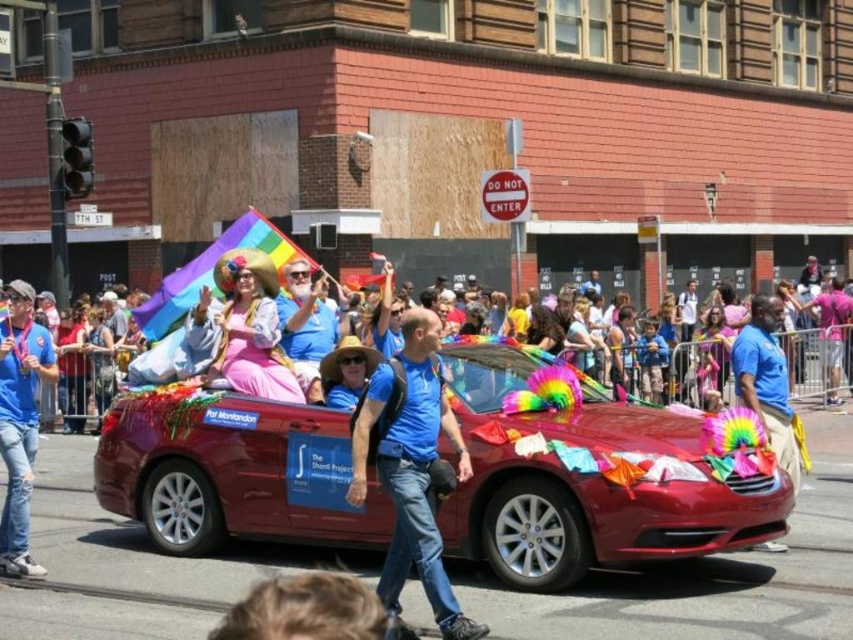
Question: Which is nearer to the shiny red convertible at center?

Choices:
 (A) blue cotton shirt at center
 (B) blue t-shirt at center
 (C) pastel fabric dress at center
 (D) matte blue shirt at center

Answer: (A)

Question: Is blue denim jeans at left to the left of blue t-shirt at center from the viewer's perspective?

Choices:
 (A) no
 (B) yes

Answer: (B)

Question: Is matte pink fabric at center smaller than matte blue shirt at center?

Choices:
 (A) no
 (B) yes

Answer: (A)

Question: Which object is positioned closest to the blonde hair at lower center?

Choices:
 (A) matte pink fabric at center
 (B) shiny red convertible at center
 (C) blue denim jeans at left

Answer: (B)

Question: Which point is farther to the camera?

Choices:
 (A) blue denim jeans at left
 (B) blue cotton shirt at center
 (C) pastel fabric dress at center
 (D) matte pink fabric at center

Answer: (C)

Question: Can you confirm if shiny red convertible at center is thinner than blue cotton shirt at center?

Choices:
 (A) no
 (B) yes

Answer: (A)